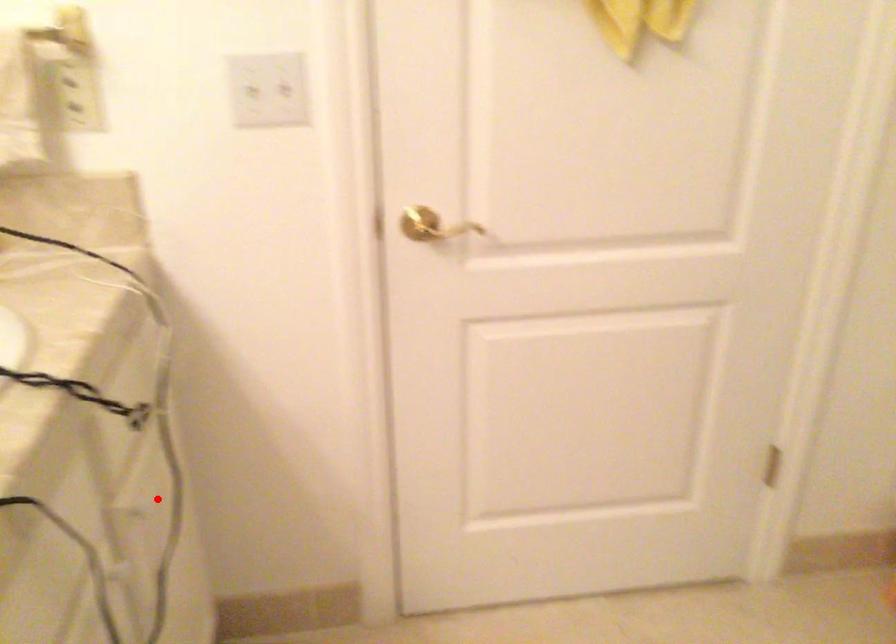
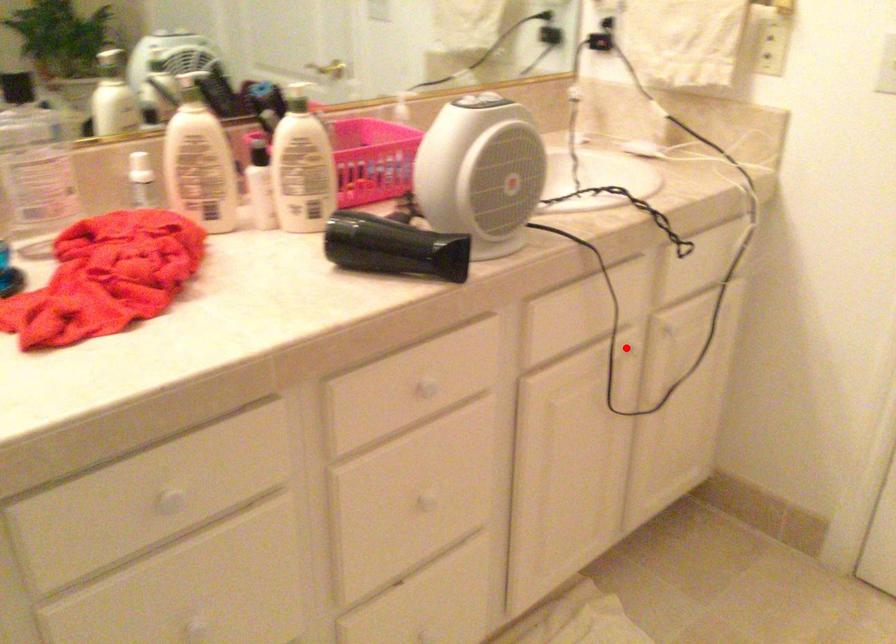
I am providing you with two images of the same scene from different viewpoints. A red point is marked on the first image and another point is marked on the second image. Does the point marked in image1 correspond to the same location as the one in image2?

No